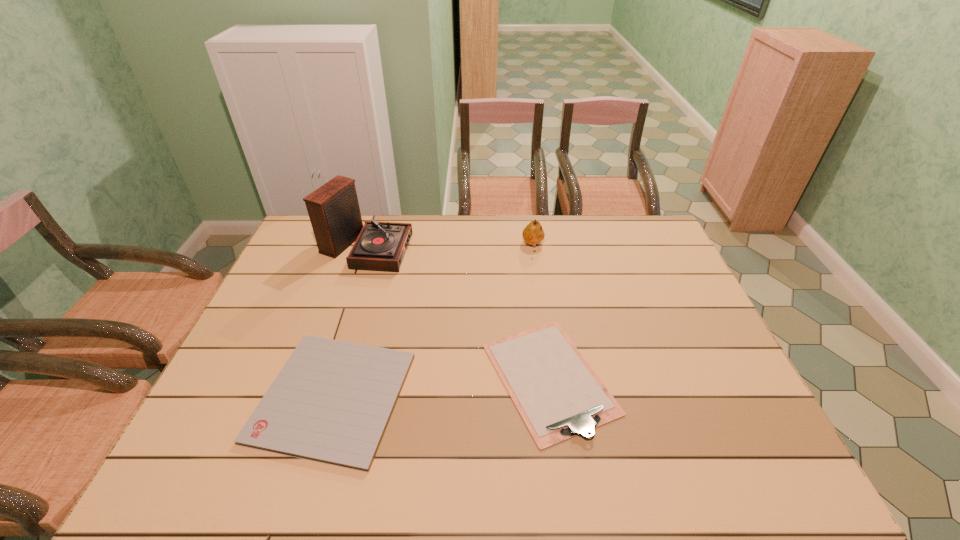
The height and width of the screenshot is (540, 960). In order to click on phonograph record present at the far edge in this screenshot , I will do `click(334, 212)`.

Where is `pear that is positioned at the far edge`? The width and height of the screenshot is (960, 540). pear that is positioned at the far edge is located at coordinates (533, 233).

I want to click on phonograph record that is at the left edge, so click(x=334, y=212).

Where is `clipboard that is at the left edge`? The height and width of the screenshot is (540, 960). clipboard that is at the left edge is located at coordinates (331, 402).

Locate an element on the screen. The image size is (960, 540). object at the far left corner is located at coordinates (334, 212).

Identify the location of object present at the near left corner. Image resolution: width=960 pixels, height=540 pixels. (331, 402).

Find the location of `free space at the far edge of the desktop`. free space at the far edge of the desktop is located at coordinates (585, 235).

Locate an element on the screen. The height and width of the screenshot is (540, 960). free space at the near edge of the desktop is located at coordinates (511, 450).

Locate an element on the screen. Image resolution: width=960 pixels, height=540 pixels. free spot at the left edge of the desktop is located at coordinates (229, 383).

You are a GUI agent. You are given a task and a screenshot of the screen. Output one action in this format:
    pyautogui.click(x=<x>, y=<y>)
    Task: Click on the blank area at the far left corner
    This screenshot has height=540, width=960.
    Given the screenshot: What is the action you would take?
    pyautogui.click(x=312, y=252)